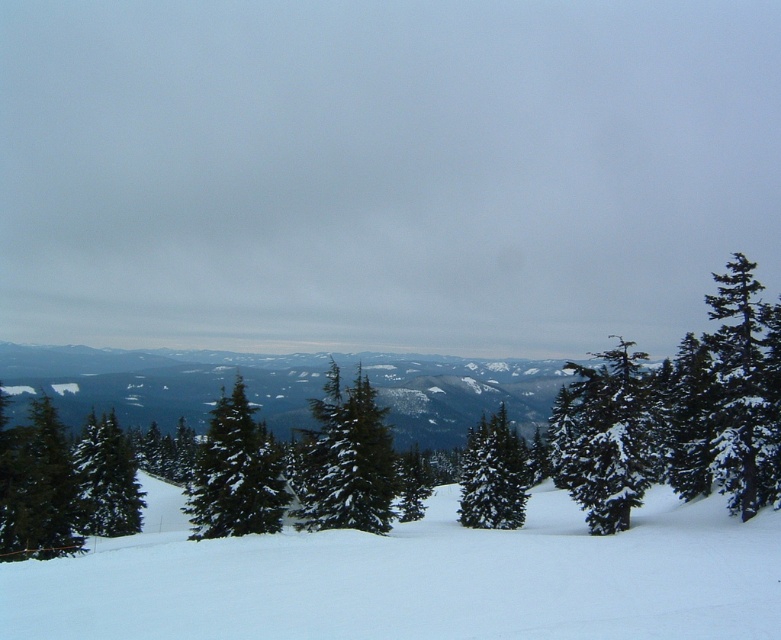
Question: Can you confirm if green matte evergreen tree at center is positioned to the left of green matte tree at center?

Choices:
 (A) yes
 (B) no

Answer: (A)

Question: Does white snow at lower left have a larger size compared to snow-covered evergreen tree at center?

Choices:
 (A) no
 (B) yes

Answer: (B)

Question: Based on their relative distances, which object is nearer to the green matte evergreen at left?

Choices:
 (A) green matte evergreen tree at center
 (B) snow-covered evergreen at right
 (C) green matte tree at lower left

Answer: (C)

Question: Which is nearer to the green matte tree at lower left?

Choices:
 (A) green matte evergreen tree at center
 (B) green matte evergreen at left

Answer: (B)

Question: Which of the following is the farthest from the observer?

Choices:
 (A) (91, 449)
 (B) (269, 500)
 (C) (373, 470)
 (D) (473, 465)

Answer: (A)

Question: Does snow-covered evergreen at right appear on the left side of green matte tree at center?

Choices:
 (A) no
 (B) yes

Answer: (B)